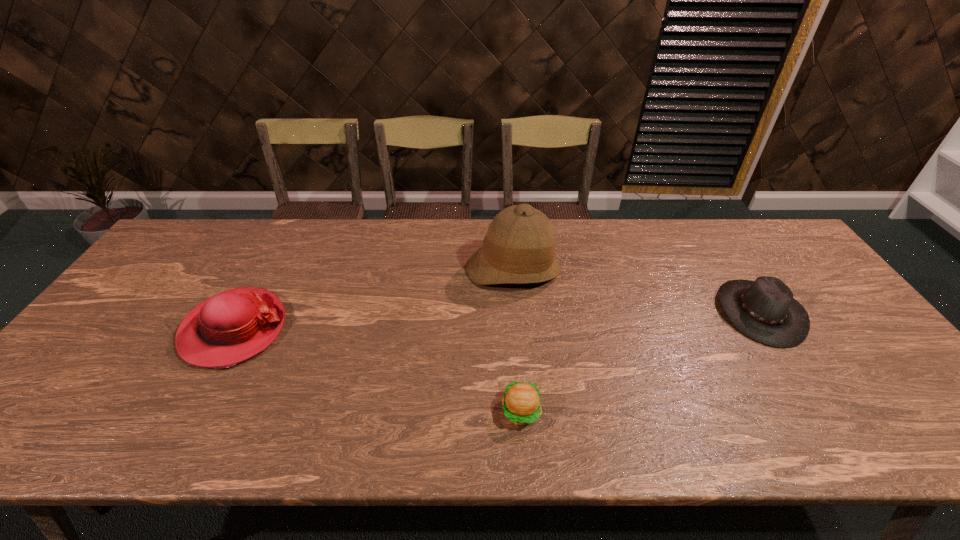
Locate an element on the screen. This screenshot has width=960, height=540. free space at the far right corner is located at coordinates (764, 258).

Where is `unoccupied area between the leftmost hat and the rightmost hat`? This screenshot has width=960, height=540. unoccupied area between the leftmost hat and the rightmost hat is located at coordinates (497, 321).

Where is `unoccupied position between the tallest hat and the third shortest object`? This screenshot has width=960, height=540. unoccupied position between the tallest hat and the third shortest object is located at coordinates tap(373, 299).

The height and width of the screenshot is (540, 960). I want to click on free area in between the rightmost object and the second shortest hat, so click(497, 321).

Identify the location of free space between the shortest hat and the leftmost hat. The height and width of the screenshot is (540, 960). (497, 321).

Where is `free space between the second tallest object and the shortest object`? free space between the second tallest object and the shortest object is located at coordinates (377, 370).

The height and width of the screenshot is (540, 960). What are the coordinates of `free space between the second shortest object and the nearest object` in the screenshot? It's located at (640, 362).

Where is `free space between the second tallest hat and the second hat from left to right`? This screenshot has height=540, width=960. free space between the second tallest hat and the second hat from left to right is located at coordinates (373, 299).

Identify the location of vacant area between the second shortest object and the hamburger. (640, 362).

Where is `free space between the leftmost hat and the nearest object`? The image size is (960, 540). free space between the leftmost hat and the nearest object is located at coordinates (x=377, y=370).